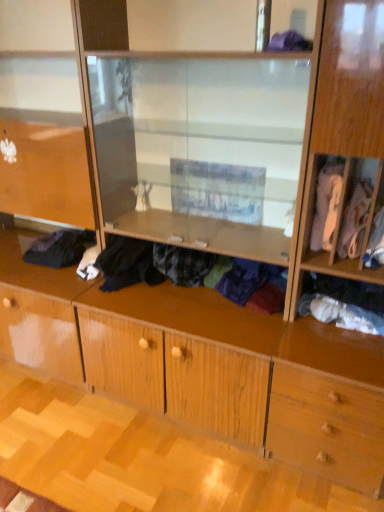
Image resolution: width=384 pixels, height=512 pixels. Find the location of `empty space that is ontop of white fabric at lower right, which is counted as the 6th clothing, starting from the left (from a real-world perspective)`. empty space that is ontop of white fabric at lower right, which is counted as the 6th clothing, starting from the left (from a real-world perspective) is located at coordinates (350, 304).